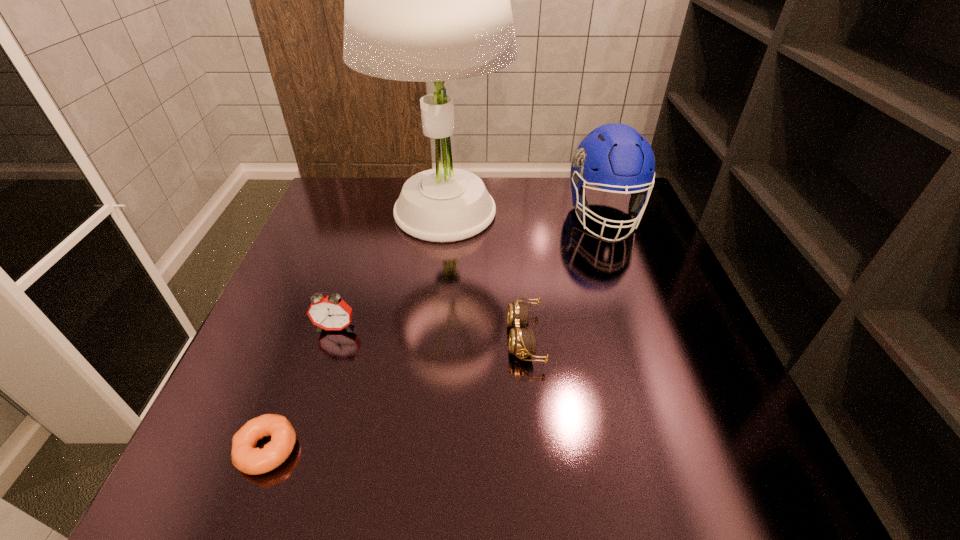
At what (x,y) coordinates should I click in order to perform the action: click on object present at the near left corner. Please return your answer as a coordinate pair (x, y). The width and height of the screenshot is (960, 540). Looking at the image, I should click on (245, 457).

Identify the location of object that is at the far right corner. This screenshot has height=540, width=960. click(615, 157).

You are a GUI agent. You are given a task and a screenshot of the screen. Output one action in this format:
    pyautogui.click(x=<x>, y=<y>)
    Task: Click on the vacant space at the far edge of the desktop
    The width and height of the screenshot is (960, 540).
    Given the screenshot: What is the action you would take?
    pyautogui.click(x=504, y=200)

Where is `free space at the near edge`? free space at the near edge is located at coordinates (500, 447).

At what (x,y) coordinates should I click in order to perform the action: click on vacant space at the left edge. Please return your answer as a coordinate pair (x, y). The image size is (960, 540). Looking at the image, I should click on (318, 245).

This screenshot has height=540, width=960. In the image, there is a desktop. What are the coordinates of `vacant region at the right edge` in the screenshot? It's located at (672, 413).

Locate an element on the screen. vacant space at the far left corner of the desktop is located at coordinates (339, 188).

Locate an element on the screen. The height and width of the screenshot is (540, 960). free space at the near left corner is located at coordinates click(212, 474).

The height and width of the screenshot is (540, 960). Identify the location of free location at the far right corner of the desktop. (589, 193).

Locate an element on the screen. Image resolution: width=960 pixels, height=540 pixels. vacant space at the near right corner of the desktop is located at coordinates (755, 452).